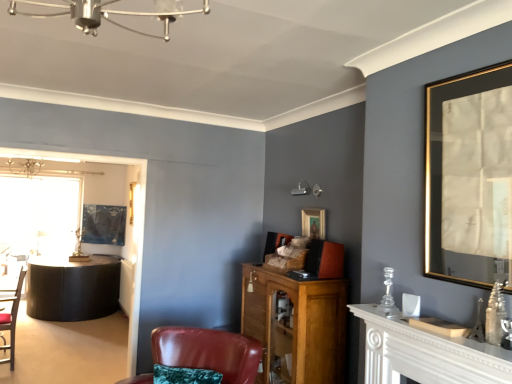
The image size is (512, 384). I want to click on free space above white wooden mantelpiece at right (from a real-world perspective), so click(439, 332).